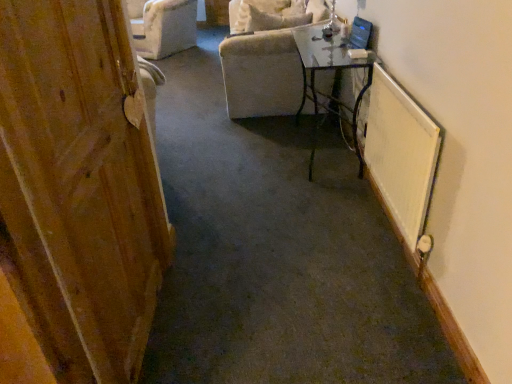
Question: From the image's perspective, is wooden door at left located above or below velvet beige armchair at upper center?

Choices:
 (A) above
 (B) below

Answer: (B)

Question: Looking at their shapes, would you say wooden door at left is wider or thinner than velvet beige armchair at upper center?

Choices:
 (A) wide
 (B) thin

Answer: (B)

Question: Which is nearer to the wooden door at left?

Choices:
 (A) clear glass table at center
 (B) white textured radiator at right
 (C) velvet beige armchair at upper center

Answer: (B)

Question: Which is nearer to the white textured radiator at right?

Choices:
 (A) velvet beige armchair at upper center
 (B) clear glass table at center
 (C) wooden door at left

Answer: (B)